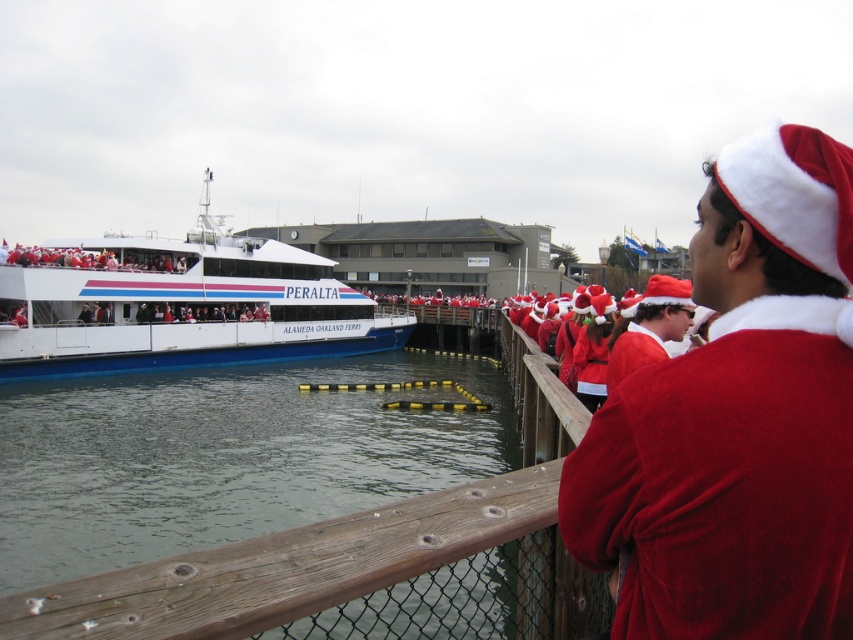
Does velvet red santa hat at upper right have a larger size compared to fuzzy red santa hat at center?

Actually, velvet red santa hat at upper right might be smaller than fuzzy red santa hat at center.

Is point (729, 472) farther from camera compared to point (654, 332)?

No, it is not.

At what (x,y) coordinates should I click in order to perform the action: click on velvet red santa hat at upper right. Please return your answer as a coordinate pair (x, y). The width and height of the screenshot is (853, 640). Looking at the image, I should click on (737, 419).

Is point (239, 451) closer to viewer compared to point (627, 372)?

No.

Is clear water at dock center thinner than fuzzy red santa hat at center?

No, clear water at dock center is not thinner than fuzzy red santa hat at center.

At what (x,y) coordinates should I click in order to perform the action: click on clear water at dock center. Please return your answer as a coordinate pair (x, y). Looking at the image, I should click on (219, 458).

The width and height of the screenshot is (853, 640). I want to click on clear water at dock center, so click(219, 458).

Consider the image. Is clear water at dock center smaller than white glossy ferry at left?

Yes.

Does point (450, 465) come in front of point (32, 310)?

That is True.

Identify the location of clear water at dock center. (219, 458).

I want to click on clear water at dock center, so click(219, 458).